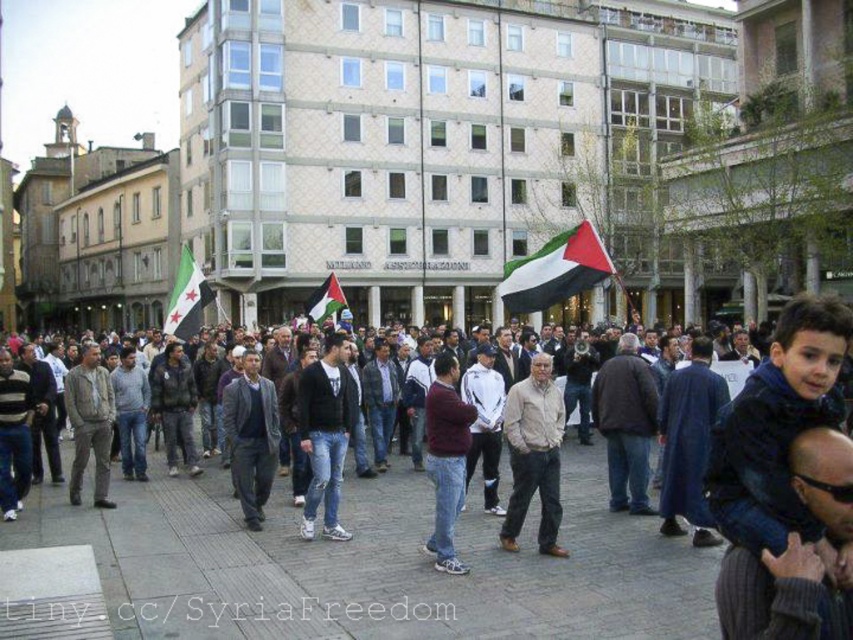
Based on the photo, you are a photographer standing at the edge of the crowd in the town square. You need to capture a photo of both the dark blue jeans at center and the dark gray wool sweater at center in the same frame. Given that your camera has a maximum focal length that allows capturing objects up to 60 feet apart in the same shot, will you be able to include both items in your photo?

The dark blue jeans at center and dark gray wool sweater at center are 62.82 feet apart from each other. Since the maximum distance your camera can capture in one shot is 60 feet, you will not be able to include both items in the same frame.

You are a photographer at the town square event and need to capture a photo of the light brown leather jacket at center and the dark gray jacket at center. Which jacket is closer to the camera?

The light brown leather jacket at center is positioned under the dark gray jacket at center, meaning it is closer to the camera.

You are a photographer trying to capture a photo of the town square gathering. You want to ensure both the point at (712, 541) and the point at (248, 349) are in focus. Given that your camera can only focus on objects within a 0.3 unit depth range, will both points be in focus?

Point (712, 541) is closer to the camera than point (248, 349). The depth difference between them is more than 0.3 units, so both points cannot be in focus simultaneously.